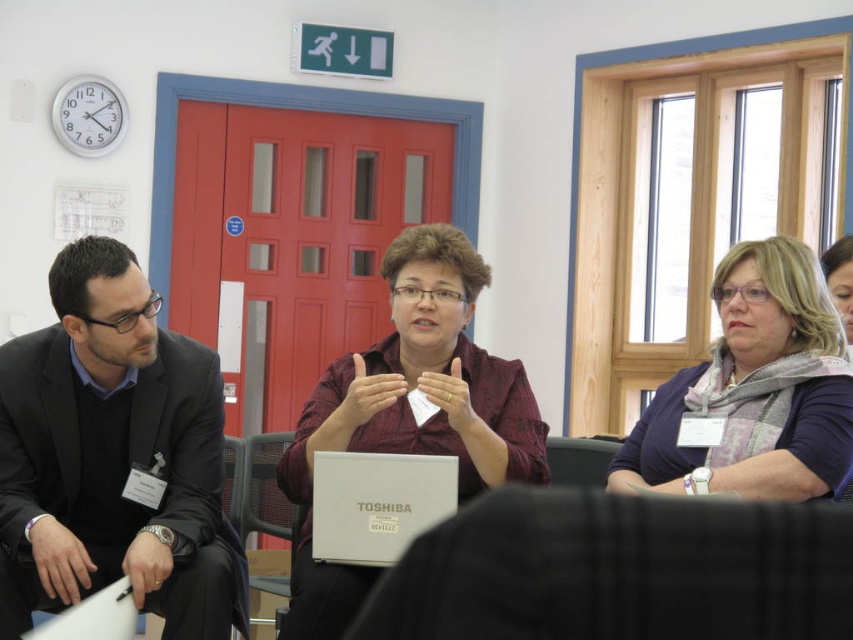
Question: Can you confirm if metallic gray chair at center is thinner than white plastic laptop at lower left?

Choices:
 (A) no
 (B) yes

Answer: (B)

Question: Which is farther from the black fabric chair at lower center?

Choices:
 (A) white plastic laptop at lower left
 (B) matte purple scarf at upper right
 (C) light brown scarf at right

Answer: (B)

Question: Which of the following is the farthest from the observer?

Choices:
 (A) (83, 630)
 (B) (177, 371)
 (C) (251, 520)
 (D) (479, 362)

Answer: (C)

Question: Which point is farther to the camera?

Choices:
 (A) white plastic laptop at lower left
 (B) maroon fabric shirt at center
 (C) light brown scarf at right

Answer: (B)

Question: Does white plastic laptop at lower left have a larger size compared to matte purple scarf at upper right?

Choices:
 (A) no
 (B) yes

Answer: (B)

Question: Does silver metallic laptop at center appear under white plastic laptop at lower left?

Choices:
 (A) no
 (B) yes

Answer: (A)